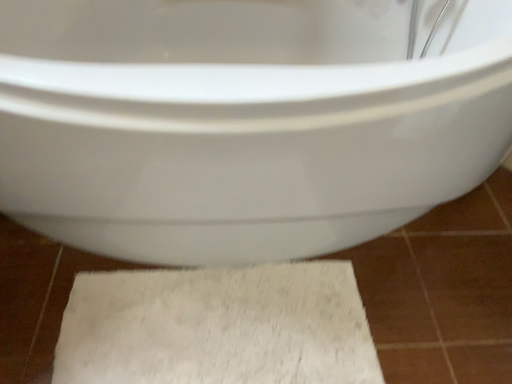
Question: From a real-world perspective, is white glossy toilet at center positioned above or below white fluffy bath mat at lower center?

Choices:
 (A) above
 (B) below

Answer: (A)

Question: Is white glossy toilet at center spatially inside white fluffy bath mat at lower center, or outside of it?

Choices:
 (A) outside
 (B) inside

Answer: (A)

Question: In the image, is white glossy toilet at center positioned in front of or behind white fluffy bath mat at lower center?

Choices:
 (A) behind
 (B) front

Answer: (B)

Question: Based on their sizes in the image, would you say white fluffy bath mat at lower center is bigger or smaller than white glossy toilet at center?

Choices:
 (A) small
 (B) big

Answer: (A)

Question: Relative to white glossy toilet at center, is white fluffy bath mat at lower center in front or behind?

Choices:
 (A) front
 (B) behind

Answer: (B)

Question: Is white fluffy bath mat at lower center inside or outside of white glossy toilet at center?

Choices:
 (A) outside
 (B) inside

Answer: (B)

Question: Looking at their shapes, would you say white fluffy bath mat at lower center is wider or thinner than white glossy toilet at center?

Choices:
 (A) wide
 (B) thin

Answer: (B)